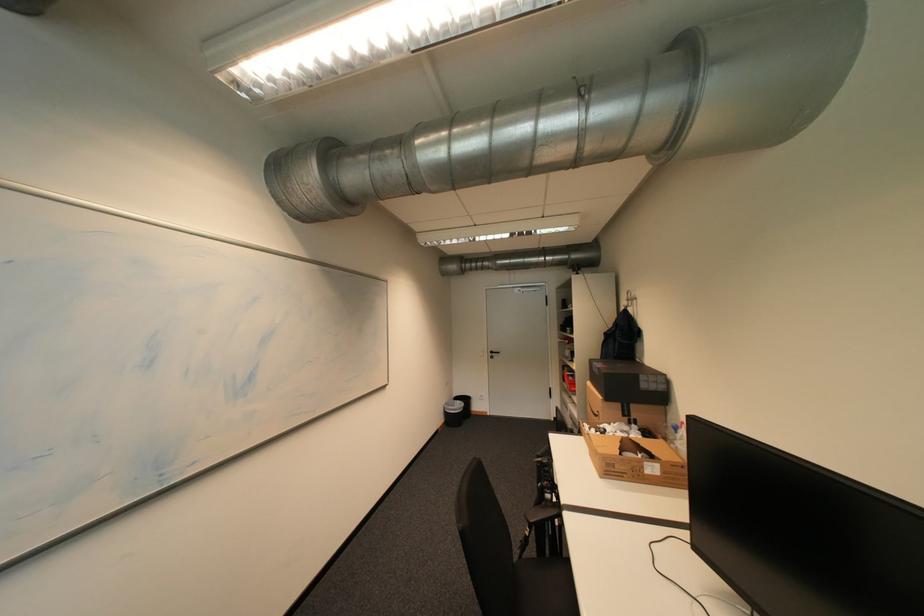
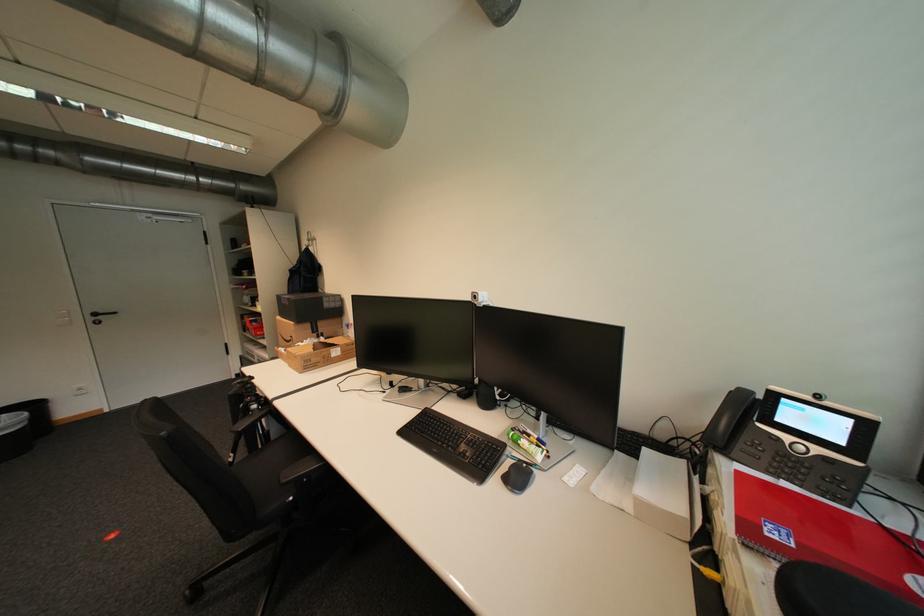
Locate, in the second image, the point that corresponds to point 623,472 in the first image.

(319, 365)